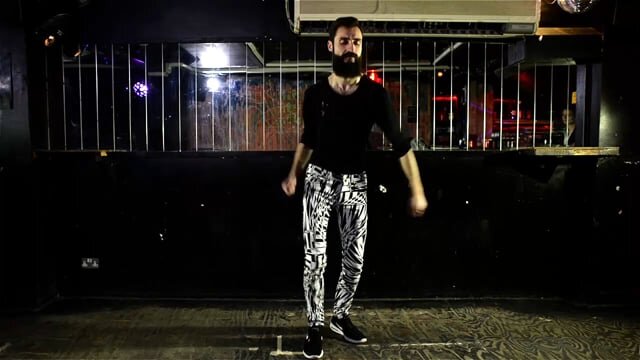
At what (x,y) coordinates should I click in order to perform the action: click on disco style light. Please return your answer as a coordinate pair (x, y). Image resolution: width=640 pixels, height=360 pixels. Looking at the image, I should click on (145, 86).